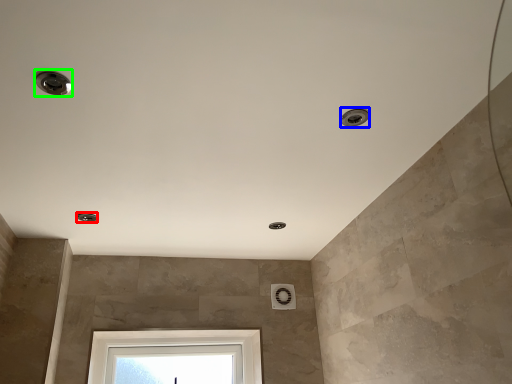
Question: Which is farther away from droplight (highlighted by a red box)? droplight (highlighted by a blue box) or droplight (highlighted by a green box)?

Choices:
 (A) droplight
 (B) droplight

Answer: (A)